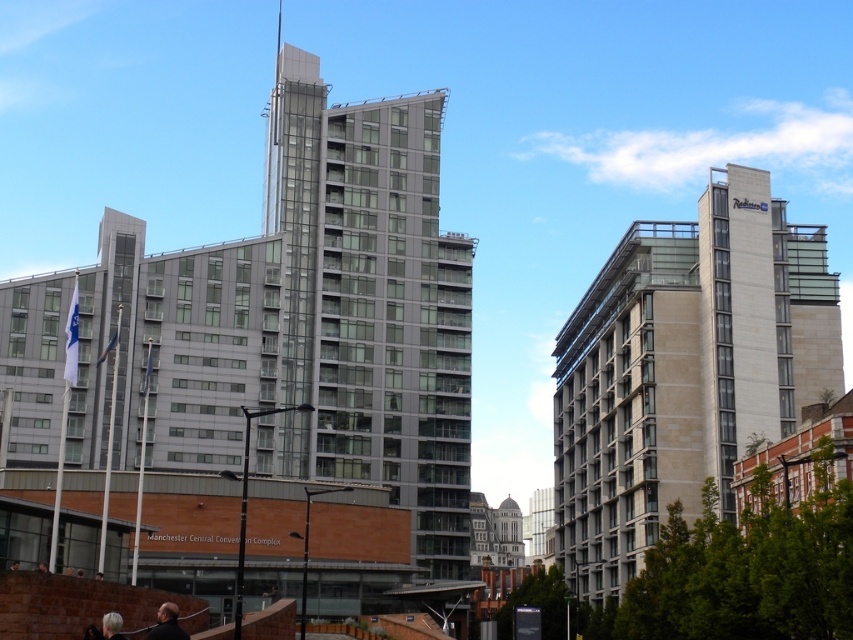
Who is more forward, (712, 237) or (344, 285)?

Point (712, 237) is in front.

Is beige stone building at right thinner than glassy metallic building at center?

Incorrect, beige stone building at right's width is not less than glassy metallic building at center's.

Describe the element at coordinates (683, 369) in the screenshot. The image size is (853, 640). I see `beige stone building at right` at that location.

Identify the location of beige stone building at right. The image size is (853, 640). (683, 369).

Does glassy metallic building at center appear under dark brown leather jacket at lower center?

Actually, glassy metallic building at center is above dark brown leather jacket at lower center.

Does glassy metallic building at center appear on the right side of dark brown leather jacket at lower center?

Indeed, glassy metallic building at center is positioned on the right side of dark brown leather jacket at lower center.

What do you see at coordinates (372, 304) in the screenshot? This screenshot has width=853, height=640. I see `glassy metallic building at center` at bounding box center [372, 304].

In order to click on glassy metallic building at center in this screenshot , I will do `click(372, 304)`.

Describe the element at coordinates (683, 369) in the screenshot. I see `beige stone building at right` at that location.

Who is taller, beige stone building at right or dark brown leather jacket at lower center?

With more height is beige stone building at right.

Which is in front, point (628, 477) or point (165, 609)?

Point (165, 609) is in front.

Locate an element on the screen. Image resolution: width=853 pixels, height=640 pixels. beige stone building at right is located at coordinates (683, 369).